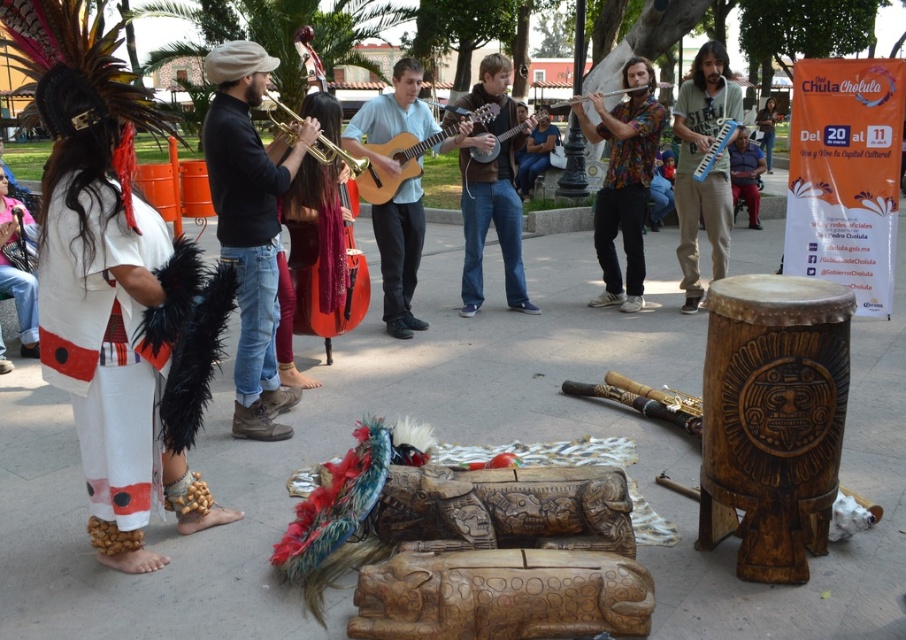
Can you confirm if brown carved drum at center is wider than blue denim jeans at center?

Incorrect, brown carved drum at center's width does not surpass blue denim jeans at center's.

The height and width of the screenshot is (640, 906). What do you see at coordinates (772, 419) in the screenshot?
I see `brown carved drum at center` at bounding box center [772, 419].

Locate an element on the screen. brown carved drum at center is located at coordinates (772, 419).

Based on the photo, which is more to the right, matte black trumpet at center or light brown wooden guitar at center?

Positioned to the right is light brown wooden guitar at center.

Can you confirm if matte black trumpet at center is positioned to the right of light brown wooden guitar at center?

Incorrect, matte black trumpet at center is not on the right side of light brown wooden guitar at center.

Does point (257, 72) come behind point (495, 104)?

No, (257, 72) is closer to viewer.

Where is `matte black trumpet at center`? The width and height of the screenshot is (906, 640). matte black trumpet at center is located at coordinates (249, 225).

Describe the element at coordinates (493, 221) in the screenshot. I see `brown leather banjo at center` at that location.

Is brown leather banjo at center above wooden acoustic guitar at center?

No, brown leather banjo at center is not above wooden acoustic guitar at center.

Which is in front, point (471, 307) or point (516, 129)?

Point (516, 129) is in front.

Where is `brown leather banjo at center`? brown leather banjo at center is located at coordinates click(x=493, y=221).